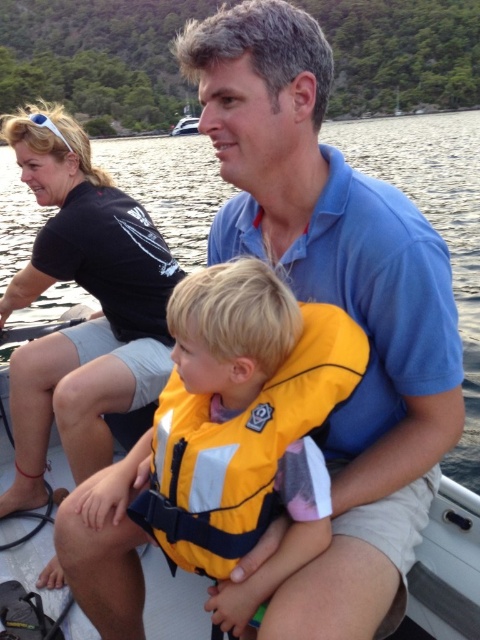
Is point (71, 355) less distant than point (288, 444)?

No, it is not.

Does black fabric shirt at upper left have a larger size compared to yellow fabric life jacket at center?

Correct, black fabric shirt at upper left is larger in size than yellow fabric life jacket at center.

Which is behind, point (47, 365) or point (210, 452)?

The point (47, 365) is more distant.

You are a GUI agent. You are given a task and a screenshot of the screen. Output one action in this format:
    pyautogui.click(x=<x>, y=<y>)
    Task: Click on the black fabric shirt at upper left
    
    Given the screenshot: What is the action you would take?
    pyautogui.click(x=91, y=314)